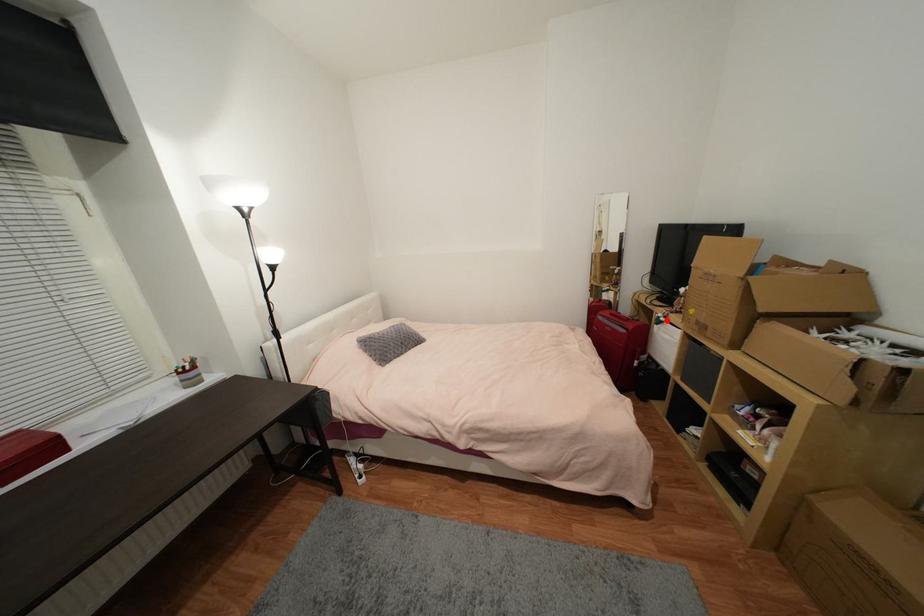
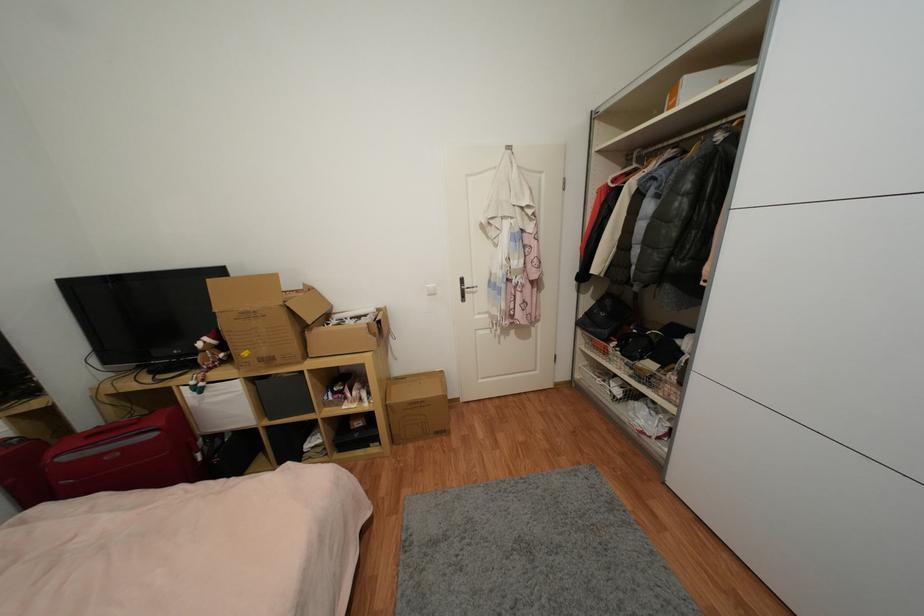
In the second image, find the point that corresponds to the highlighted location in the first image.

(205, 386)